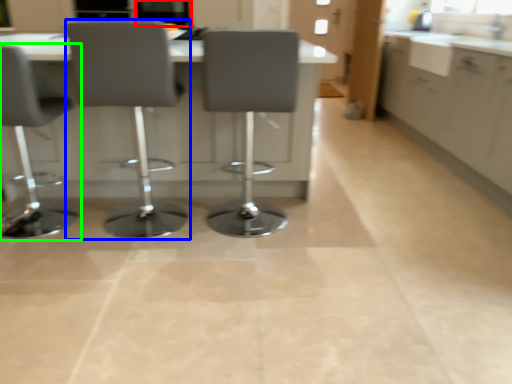
Question: Based on their relative distances, which object is nearer to window screen (highlighted by a red box)? Choose from chair (highlighted by a blue box) and chair (highlighted by a green box).

Choices:
 (A) chair
 (B) chair

Answer: (B)